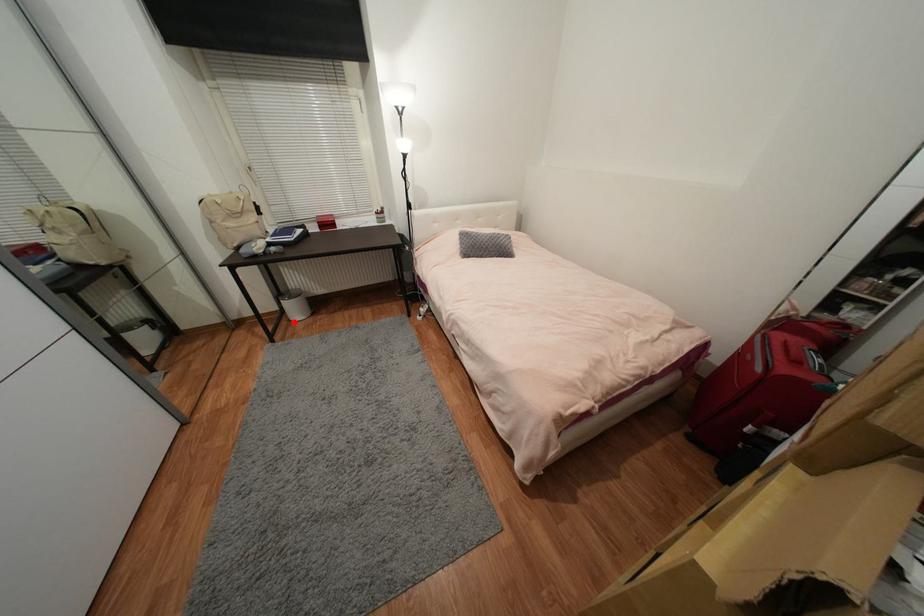
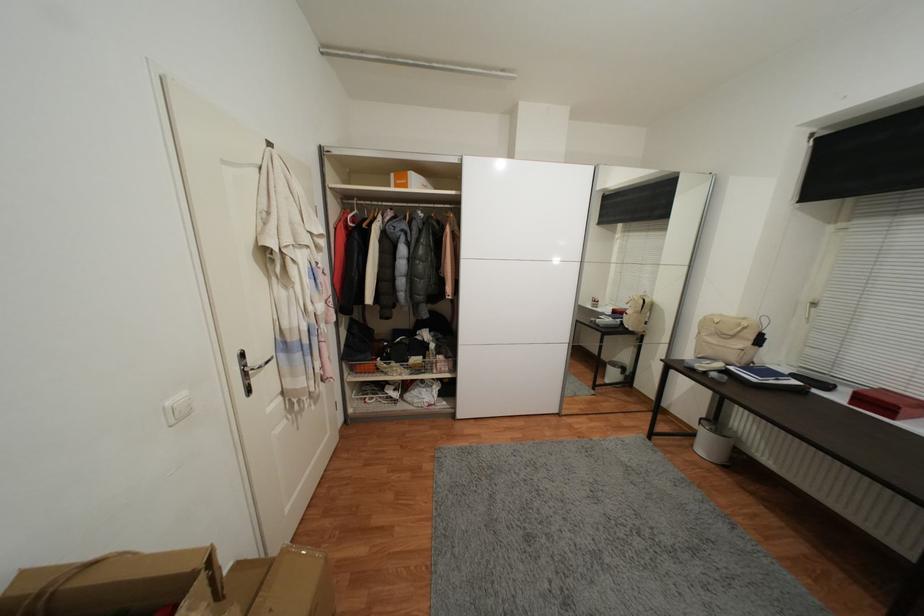
Find the pixel in the second image that matches the highlighted location in the first image.

(697, 447)